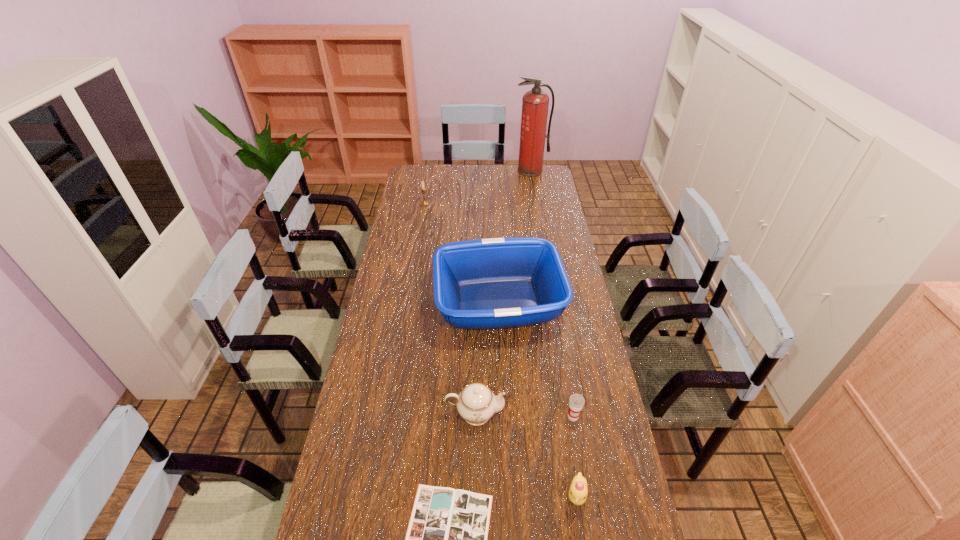
You are a GUI agent. You are given a task and a screenshot of the screen. Output one action in this format:
    pyautogui.click(x=<x>, y=<y>)
    Task: Click on the object that stands as the fifth closest to the third farthest object
    The image size is (960, 540).
    Given the screenshot: What is the action you would take?
    pyautogui.click(x=423, y=203)

Where is `object that is the fifth closest to the duckling`? The height and width of the screenshot is (540, 960). object that is the fifth closest to the duckling is located at coordinates (423, 203).